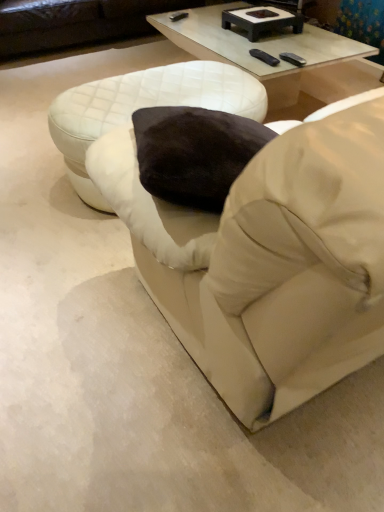
Question: From a real-world perspective, is beige fabric bean bag chair at center below clear glass coffee table at upper center?

Choices:
 (A) yes
 (B) no

Answer: (B)

Question: Are beige fabric bean bag chair at center and clear glass coffee table at upper center located far from each other?

Choices:
 (A) yes
 (B) no

Answer: (A)

Question: Can you confirm if beige fabric bean bag chair at center is smaller than clear glass coffee table at upper center?

Choices:
 (A) no
 (B) yes

Answer: (A)

Question: From the image's perspective, does beige fabric bean bag chair at center appear higher than clear glass coffee table at upper center?

Choices:
 (A) yes
 (B) no

Answer: (B)

Question: Does beige fabric bean bag chair at center have a greater width compared to clear glass coffee table at upper center?

Choices:
 (A) yes
 (B) no

Answer: (A)

Question: From a real-world perspective, relative to black matte rectangular tray at upper center, is beige fabric bean bag chair at center vertically above or below?

Choices:
 (A) above
 (B) below

Answer: (A)

Question: In terms of width, does beige fabric bean bag chair at center look wider or thinner when compared to black matte rectangular tray at upper center?

Choices:
 (A) wide
 (B) thin

Answer: (A)

Question: Visually, is beige fabric bean bag chair at center positioned to the left or to the right of black matte rectangular tray at upper center?

Choices:
 (A) right
 (B) left

Answer: (A)

Question: Considering their positions, is beige fabric bean bag chair at center located in front of or behind black matte rectangular tray at upper center?

Choices:
 (A) behind
 (B) front

Answer: (B)

Question: Considering the positions of point (355, 357) and point (84, 103), is point (355, 357) closer or farther from the camera than point (84, 103)?

Choices:
 (A) farther
 (B) closer

Answer: (B)

Question: Relative to white quilted ottoman at center, is beige fabric bean bag chair at center in front or behind?

Choices:
 (A) behind
 (B) front

Answer: (B)

Question: From the image's perspective, is beige fabric bean bag chair at center located above or below white quilted ottoman at center?

Choices:
 (A) above
 (B) below

Answer: (B)

Question: Is beige fabric bean bag chair at center bigger or smaller than white quilted ottoman at center?

Choices:
 (A) big
 (B) small

Answer: (A)

Question: Relative to black rubber remote at upper right, is beige fabric bean bag chair at center in front or behind?

Choices:
 (A) behind
 (B) front

Answer: (B)

Question: Looking at their shapes, would you say beige fabric bean bag chair at center is wider or thinner than black rubber remote at upper right?

Choices:
 (A) wide
 (B) thin

Answer: (A)